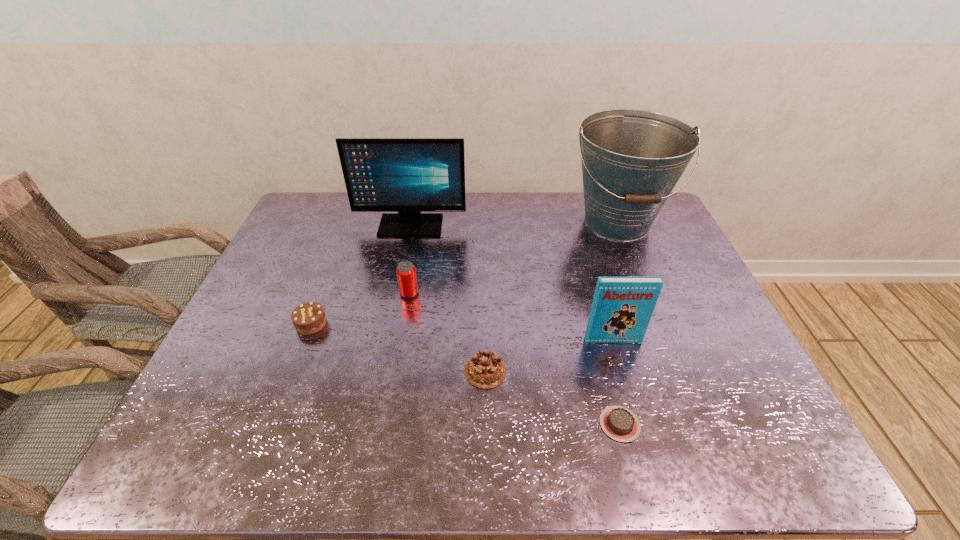
Identify which object is the third closest to the shortest chocolate cake. Please provide its 2D coordinates. Your answer should be formatted as a tuple, i.e. [(x, y)], where the tuple contains the x and y coordinates of a point satisfying the conditions above.

[(632, 159)]

Identify which object is the fifth nearest to the nearest chocolate cake. Please provide its 2D coordinates. Your answer should be formatted as a tuple, i.e. [(x, y)], where the tuple contains the x and y coordinates of a point satisfying the conditions above.

[(308, 318)]

Image resolution: width=960 pixels, height=540 pixels. What are the coordinates of `the second closest chocolate cake to the monitor` in the screenshot? It's located at (485, 369).

Where is `the second closest chocolate cake to the bucket`? The height and width of the screenshot is (540, 960). the second closest chocolate cake to the bucket is located at coordinates (619, 423).

Locate an element on the screen. This screenshot has width=960, height=540. free location that satisfies the following two spatial constraints: 1. on the screen side of the monitor; 2. on the right side of the third farthest object is located at coordinates (397, 294).

You are a GUI agent. You are given a task and a screenshot of the screen. Output one action in this format:
    pyautogui.click(x=<x>, y=<y>)
    Task: Click on the vacant region that satisfies the following two spatial constraints: 1. on the screen side of the second chocolate cake from right to left; 2. on the right side of the monitor
    The width and height of the screenshot is (960, 540).
    Given the screenshot: What is the action you would take?
    pyautogui.click(x=382, y=371)

Where is `free space that satisfies the following two spatial constraints: 1. on the front side of the fourth object from right to left; 2. on the left side of the third shortest object`? free space that satisfies the following two spatial constraints: 1. on the front side of the fourth object from right to left; 2. on the left side of the third shortest object is located at coordinates (293, 371).

In order to click on free space that satisfies the following two spatial constraints: 1. on the back side of the can; 2. on the right side of the fifth tallest object in this screenshot , I will do `click(323, 294)`.

Where is `free space in the image that satisfies the following two spatial constraints: 1. on the screen side of the monitor; 2. on the left side of the fourth shortest object`? The height and width of the screenshot is (540, 960). free space in the image that satisfies the following two spatial constraints: 1. on the screen side of the monitor; 2. on the left side of the fourth shortest object is located at coordinates (397, 294).